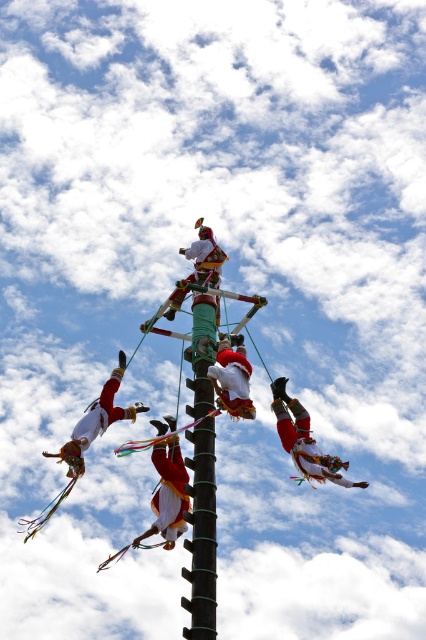
You are a photographer trying to capture the cultural performance. You notice the green painted wood pole at center and the red velvet ribbon at center. Which object should you focus on if you want to photograph something taller?

The green painted wood pole at center is taller than the red velvet ribbon at center, so you should focus on the green painted wood pole at center.

You are an event planner setting up a safety net for the performers. The safety net must be placed below the lowest performer on the green painted wood pole at center and the white cotton fabric at center. Which performer requires the safety net to be placed lower?

The safety net should be placed lower for the green painted wood pole at center because it is much taller than the white cotton fabric at center, so the lowest performer on it would be at a lower position compared to the white cotton fabric at center.

You are a photographer trying to capture a photo of the cultural performance. You want to ensure that both the green painted wood pole at center and the white cotton fabric at center are visible in your shot. Based on their positions, which object should you position closer to the left side of your frame?

The white cotton fabric at center should be positioned closer to the left side of the frame since the green painted wood pole at center is to the right of it.